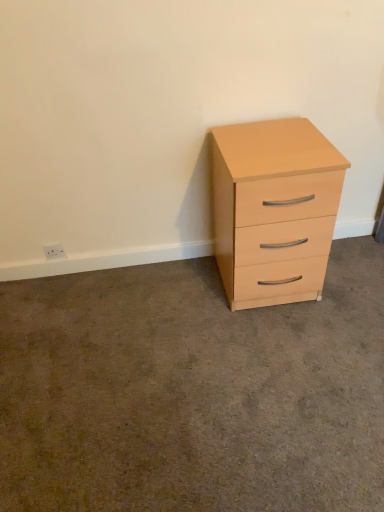
The height and width of the screenshot is (512, 384). Describe the element at coordinates (274, 210) in the screenshot. I see `matte wood chest of drawers at right` at that location.

Where is `matte wood chest of drawers at right`? Image resolution: width=384 pixels, height=512 pixels. matte wood chest of drawers at right is located at coordinates (274, 210).

Locate an element on the screen. This screenshot has height=512, width=384. matte wood chest of drawers at right is located at coordinates (274, 210).

From the image's perspective, between white plastic electric outlet at lower left and matte wood chest of drawers at right, which one is located above?

matte wood chest of drawers at right appears higher in the image.

Is white plastic electric outlet at lower left far away from matte wood chest of drawers at right?

Yes.

Which object is thinner, white plastic electric outlet at lower left or matte wood chest of drawers at right?

With smaller width is white plastic electric outlet at lower left.

How distant is white plastic electric outlet at lower left from matte wood chest of drawers at right?

white plastic electric outlet at lower left is 1.01 meters away from matte wood chest of drawers at right.

How far apart are matte wood chest of drawers at right and white plastic electric outlet at lower left?

A distance of 3.33 feet exists between matte wood chest of drawers at right and white plastic electric outlet at lower left.

In the image, is matte wood chest of drawers at right on the left side or the right side of white plastic electric outlet at lower left?

matte wood chest of drawers at right is positioned on white plastic electric outlet at lower left's right side.

Consider the image. Which point is more distant from viewer, (x=322, y=138) or (x=57, y=252)?

Point (x=57, y=252)

Is matte wood chest of drawers at right behind white plastic electric outlet at lower left?

No, it is not.

Who is smaller, white plastic electric outlet at lower left or matte wood cabinet at right?

With smaller size is white plastic electric outlet at lower left.

From the image's perspective, is white plastic electric outlet at lower left over matte wood cabinet at right?

Correct, white plastic electric outlet at lower left appears higher than matte wood cabinet at right in the image.

Does white plastic electric outlet at lower left have a lesser width compared to matte wood cabinet at right?

Indeed, white plastic electric outlet at lower left has a lesser width compared to matte wood cabinet at right.

Does white plastic electric outlet at lower left turn towards matte wood cabinet at right?

No, white plastic electric outlet at lower left is not turned towards matte wood cabinet at right.

Between matte wood cabinet at right and matte wood chest of drawers at right, which one has larger size?

matte wood chest of drawers at right.

Are matte wood cabinet at right and matte wood chest of drawers at right beside each other?

matte wood cabinet at right and matte wood chest of drawers at right are not in contact.

Measure the distance from matte wood cabinet at right to matte wood chest of drawers at right.

matte wood cabinet at right and matte wood chest of drawers at right are 18.92 inches apart.

Does point (165, 492) come behind point (251, 302)?

No, it is not.

Is matte wood cabinet at right aimed at white plastic electric outlet at lower left?

No, matte wood cabinet at right is not turned towards white plastic electric outlet at lower left.

Is matte wood cabinet at right closer to the viewer compared to white plastic electric outlet at lower left?

Yes.

Between matte wood cabinet at right and white plastic electric outlet at lower left, which one has more height?

white plastic electric outlet at lower left is taller.

This screenshot has width=384, height=512. Find the location of `concrete to the left of matte wood chest of drawers at right`. concrete to the left of matte wood chest of drawers at right is located at coordinates (192, 392).

From the image's perspective, between matte wood chest of drawers at right and matte wood cabinet at right, which one is located above?

From the image's view, matte wood chest of drawers at right is above.

Is matte wood chest of drawers at right closer to camera compared to matte wood cabinet at right?

That is False.

Is matte wood chest of drawers at right inside or outside of matte wood cabinet at right?

matte wood chest of drawers at right cannot be found inside matte wood cabinet at right.

Locate an element on the screen. This screenshot has height=512, width=384. chest of drawers in front of the white plastic electric outlet at lower left is located at coordinates (274, 210).

Where is `electric outlet behind the matte wood chest of drawers at right`? electric outlet behind the matte wood chest of drawers at right is located at coordinates (54, 251).

Looking at the image, which one is located further to white plastic electric outlet at lower left, matte wood cabinet at right or matte wood chest of drawers at right?

matte wood chest of drawers at right is further to white plastic electric outlet at lower left.

From the picture: Which object lies nearer to the anchor point matte wood chest of drawers at right, matte wood cabinet at right or white plastic electric outlet at lower left?

Among the two, matte wood cabinet at right is located nearer to matte wood chest of drawers at right.

When comparing their distances from white plastic electric outlet at lower left, does matte wood chest of drawers at right or matte wood cabinet at right seem closer?

Based on the image, matte wood cabinet at right appears to be nearer to white plastic electric outlet at lower left.

Which object lies further to the anchor point matte wood chest of drawers at right, white plastic electric outlet at lower left or matte wood cabinet at right?

The object further to matte wood chest of drawers at right is white plastic electric outlet at lower left.

Which object lies further to the anchor point matte wood cabinet at right, matte wood chest of drawers at right or white plastic electric outlet at lower left?

Based on the image, white plastic electric outlet at lower left appears to be further to matte wood cabinet at right.

Based on their spatial positions, is white plastic electric outlet at lower left or matte wood chest of drawers at right further from matte wood cabinet at right?

The object further to matte wood cabinet at right is white plastic electric outlet at lower left.

Where is `concrete between white plastic electric outlet at lower left and matte wood chest of drawers at right from left to right`? concrete between white plastic electric outlet at lower left and matte wood chest of drawers at right from left to right is located at coordinates (192, 392).